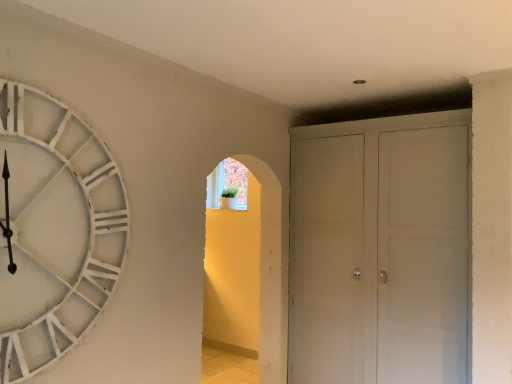
Question: Relative to white wooden clock at left, is white matte cabinet at right in front or behind?

Choices:
 (A) behind
 (B) front

Answer: (A)

Question: Is white matte cabinet at right wider or thinner than white wooden clock at left?

Choices:
 (A) thin
 (B) wide

Answer: (B)

Question: Is point (316, 200) closer or farther from the camera than point (112, 188)?

Choices:
 (A) farther
 (B) closer

Answer: (A)

Question: From a real-world perspective, relative to white matte cabinet at right, is white wooden clock at left vertically above or below?

Choices:
 (A) below
 (B) above

Answer: (B)

Question: Is white wooden clock at left bigger or smaller than white matte cabinet at right?

Choices:
 (A) small
 (B) big

Answer: (A)

Question: In terms of width, does white wooden clock at left look wider or thinner when compared to white matte cabinet at right?

Choices:
 (A) thin
 (B) wide

Answer: (A)

Question: Is white wooden clock at left inside or outside of white matte cabinet at right?

Choices:
 (A) outside
 (B) inside

Answer: (A)